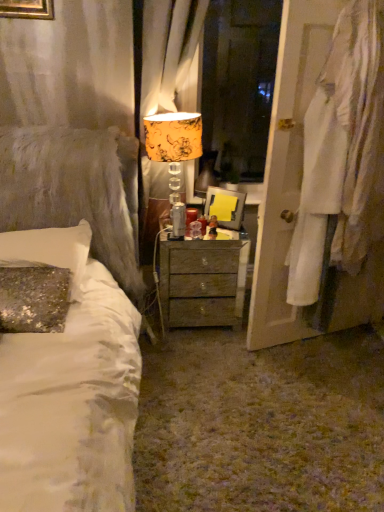
What are the coordinates of `vacant space in front of white fabric at right` in the screenshot? It's located at (317, 392).